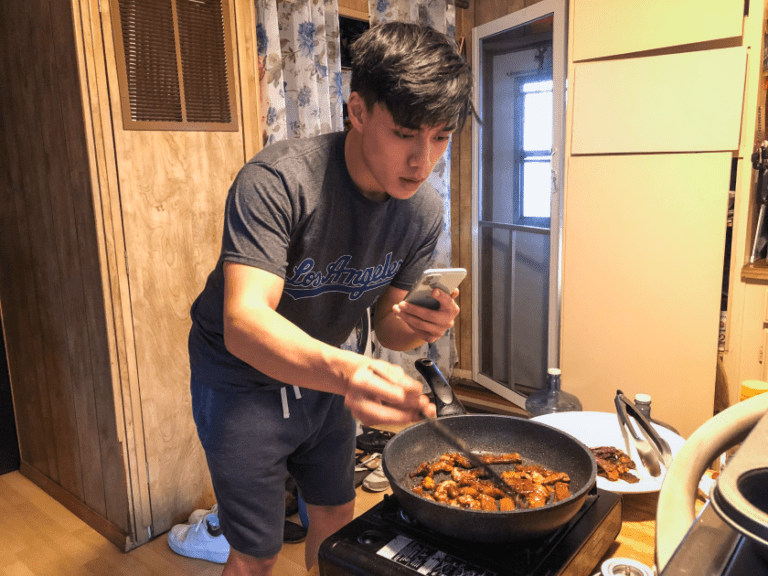
Locate an element on the screen. The height and width of the screenshot is (576, 768). wooden table is located at coordinates (631, 547).